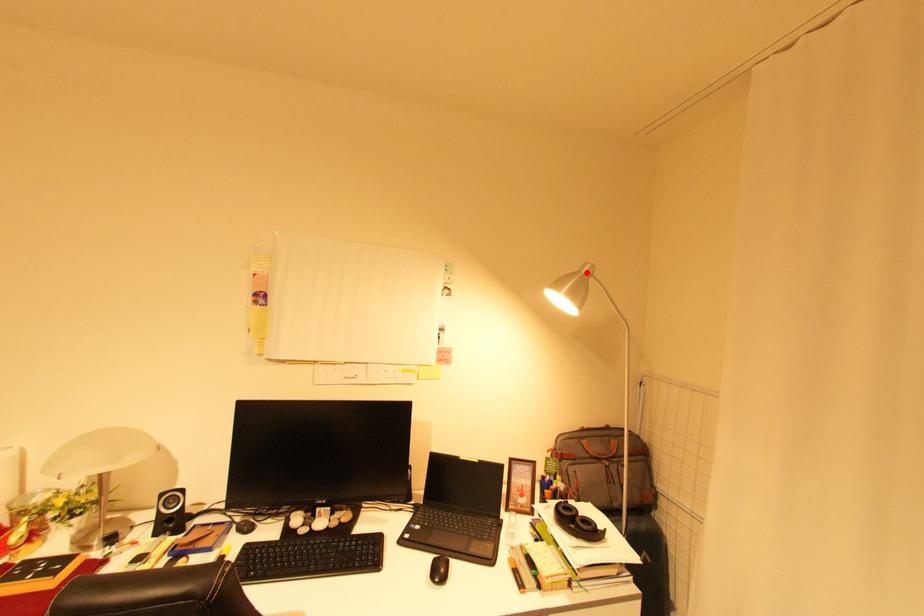
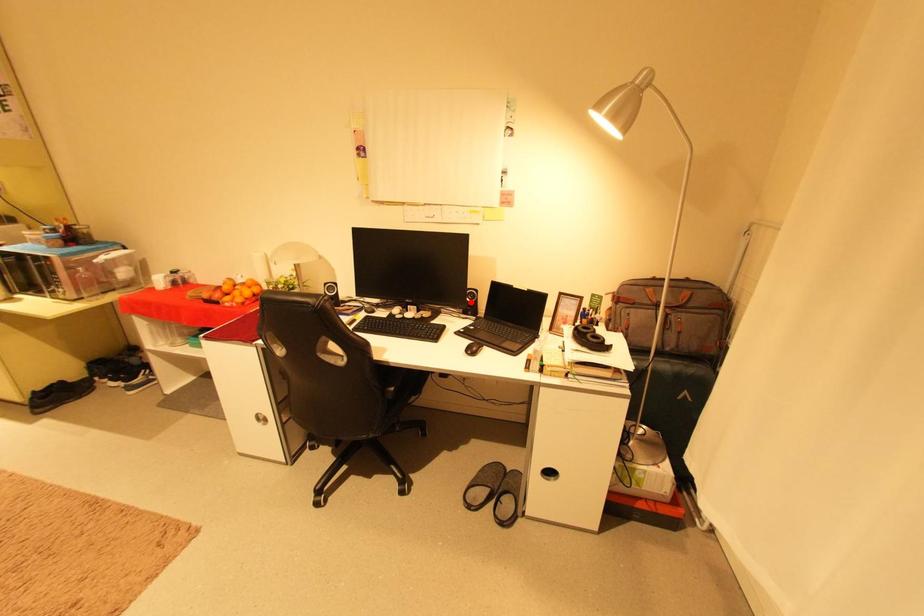
I am providing you with two images of the same scene from different viewpoints. A red point is marked on the first image and another point is marked on the second image. Is the red point in image1 aligned with the point shown in image2?

No